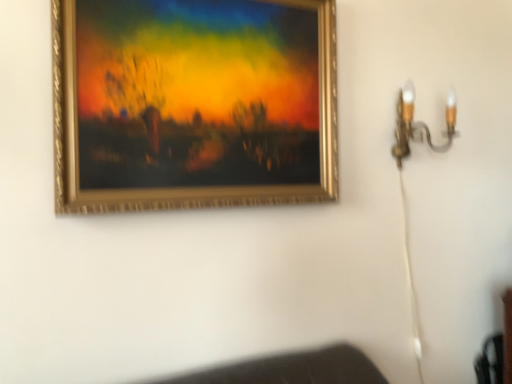
Question: Considering the positions of gold metallic wall sconce at upper right and gold-framed painting at upper center in the image, is gold metallic wall sconce at upper right taller or shorter than gold-framed painting at upper center?

Choices:
 (A) tall
 (B) short

Answer: (B)

Question: From a real-world perspective, is gold metallic wall sconce at upper right physically located above or below gold-framed painting at upper center?

Choices:
 (A) above
 (B) below

Answer: (B)

Question: Would you say gold metallic wall sconce at upper right is to the left or to the right of gold-framed painting at upper center in the picture?

Choices:
 (A) right
 (B) left

Answer: (A)

Question: Considering their positions, is gold-framed painting at upper center located in front of or behind gold metallic wall sconce at upper right?

Choices:
 (A) behind
 (B) front

Answer: (B)

Question: Visually, is gold-framed painting at upper center positioned to the left or to the right of gold metallic wall sconce at upper right?

Choices:
 (A) right
 (B) left

Answer: (B)

Question: Considering the positions of gold-framed painting at upper center and gold metallic wall sconce at upper right in the image, is gold-framed painting at upper center bigger or smaller than gold metallic wall sconce at upper right?

Choices:
 (A) big
 (B) small

Answer: (A)

Question: From their relative heights in the image, would you say gold-framed painting at upper center is taller or shorter than gold metallic wall sconce at upper right?

Choices:
 (A) tall
 (B) short

Answer: (A)